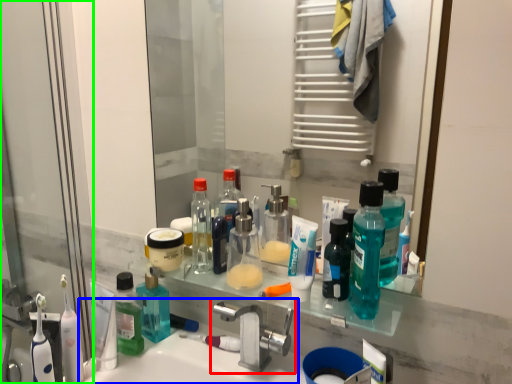
Question: Which object is the farthest from tap (highlighted by a red box)? Choose among these: sink (highlighted by a blue box) or screen door (highlighted by a green box).

Choices:
 (A) sink
 (B) screen door

Answer: (B)